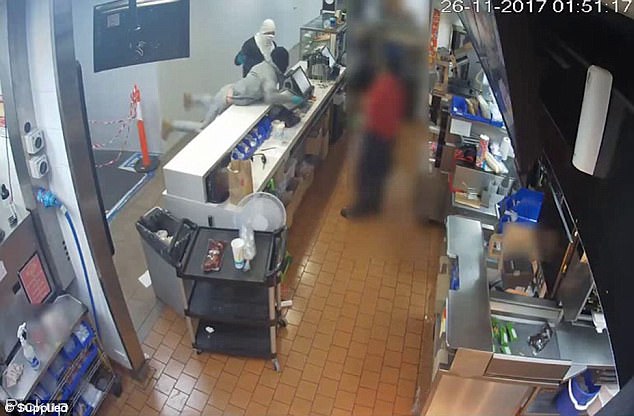
The height and width of the screenshot is (416, 634). What are the coordinates of `fan` in the screenshot? It's located at (268, 206).